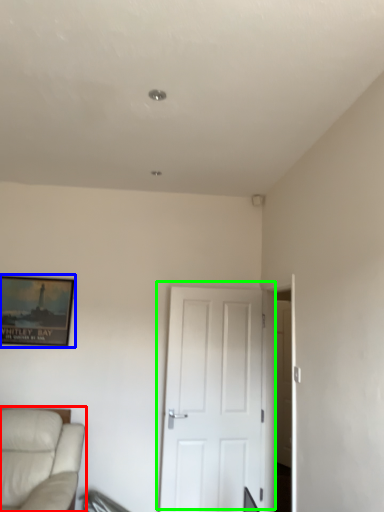
Question: Estimate the real-world distances between objects in this image. Which object is farther from studio couch (highlighted by a red box), picture frame (highlighted by a blue box) or door (highlighted by a green box)?

Choices:
 (A) picture frame
 (B) door

Answer: (B)